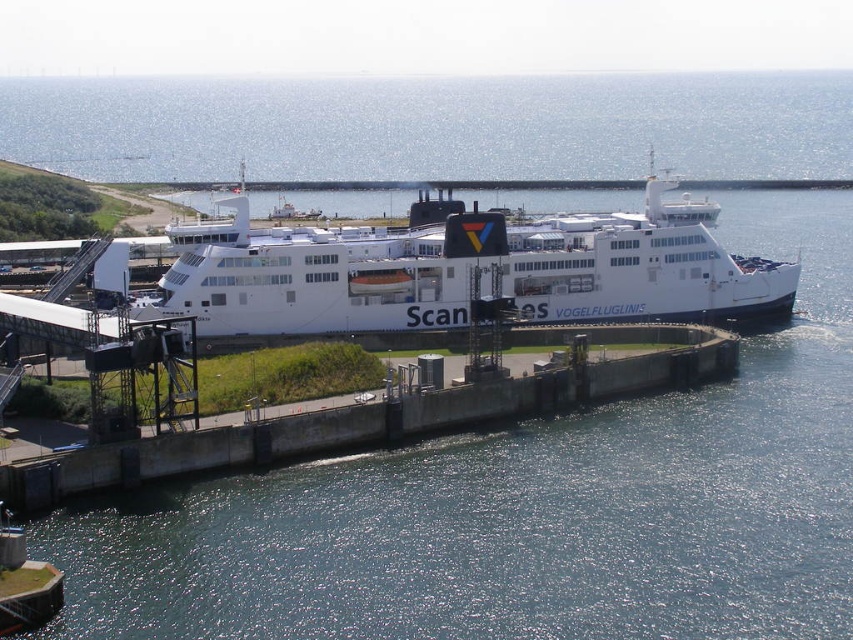
You are standing at the point marked as point (463, 269). What object is located exactly at that point?

The white matte ferry at center is located exactly at point (463, 269).

You are a dock supervisor checking the dimensions of the white matte ferry at center and the concrete at center. According to the information provided, which one is wider?

The white matte ferry at center might be wider than concrete at center according to the description.

You are standing on the grassy area near the concrete wall and looking at the white matte ferry at center and the concrete at center. Which object is closer to you?

The white matte ferry at center is closer to you than the concrete at center.